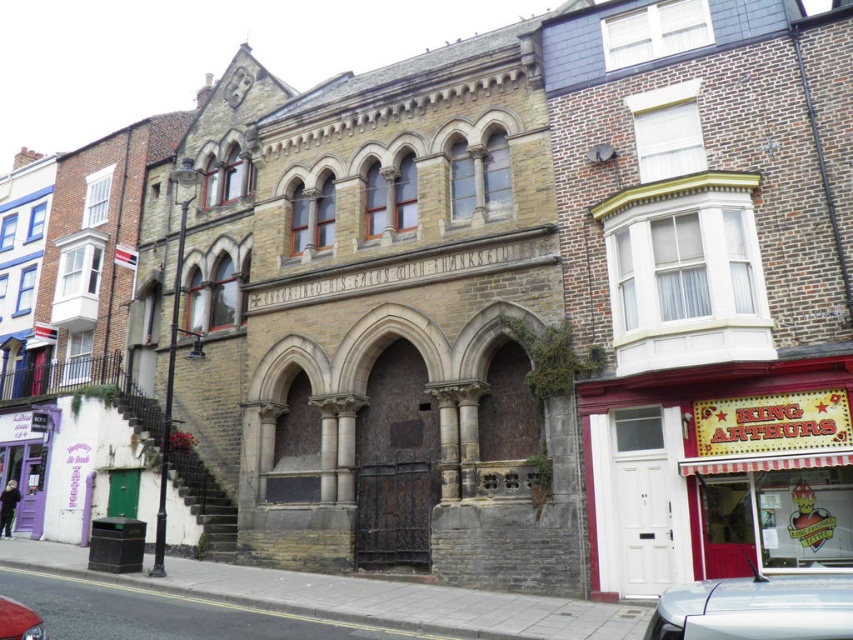
You are a delivery person who needs to park your truck between the red striped awning at lower right and the shiny red car at lower left. Your truck is 25 meters long. Can you park your truck there?

The distance between the red striped awning at lower right and the shiny red car at lower left is 28.19 meters. Since your truck is 25 meters long, it can fit within the available space.

In the scene shown: You are a photographer planning to take a photo of the historic building. You want to ensure that both the silver metallic car at lower right and the shiny red car at lower left are visible in the frame without any obstruction. Considering their heights, which car might block the view of the building if positioned closer to the camera? Explain your reasoning.

The silver metallic car at lower right is much taller than the shiny red car at lower left. If positioned closer to the camera, the silver metallic car at lower right could potentially block more of the building view due to its greater height compared to the shiny red car at lower left.

You are standing in front of the historic building and notice two points marked on the facade. The first point is at coordinates point [785,472] and the second at point [809,625]. From your vantage point, which point is closer to you?

Point [809,625] is closer to you because it is in front of point [785,472].